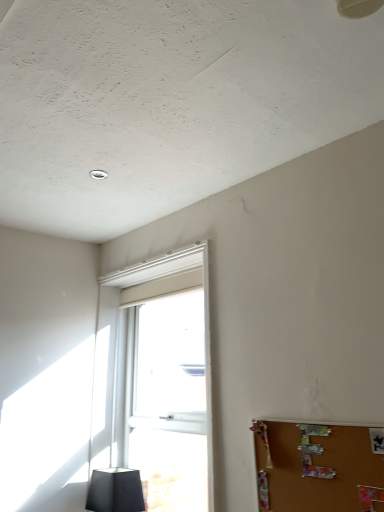
Question: Is matte black lampshade at lower left located outside brown corkboard at lower right?

Choices:
 (A) no
 (B) yes

Answer: (B)

Question: From a real-world perspective, is matte black lampshade at lower left physically below brown corkboard at lower right?

Choices:
 (A) no
 (B) yes

Answer: (B)

Question: Are matte black lampshade at lower left and brown corkboard at lower right far apart?

Choices:
 (A) yes
 (B) no

Answer: (A)

Question: Is matte black lampshade at lower left placed right next to brown corkboard at lower right?

Choices:
 (A) yes
 (B) no

Answer: (B)

Question: Does matte black lampshade at lower left have a lesser width compared to brown corkboard at lower right?

Choices:
 (A) yes
 (B) no

Answer: (B)

Question: Can you confirm if matte black lampshade at lower left is wider than brown corkboard at lower right?

Choices:
 (A) yes
 (B) no

Answer: (A)

Question: Is white plastic window at center positioned with its back to brown corkboard at lower right?

Choices:
 (A) yes
 (B) no

Answer: (B)

Question: Does white plastic window at center contain brown corkboard at lower right?

Choices:
 (A) no
 (B) yes

Answer: (A)

Question: Considering the relative sizes of white plastic window at center and brown corkboard at lower right in the image provided, is white plastic window at center smaller than brown corkboard at lower right?

Choices:
 (A) yes
 (B) no

Answer: (B)

Question: Is white plastic window at center further to the viewer compared to brown corkboard at lower right?

Choices:
 (A) no
 (B) yes

Answer: (B)

Question: Does white plastic window at center touch brown corkboard at lower right?

Choices:
 (A) yes
 (B) no

Answer: (B)

Question: From a real-world perspective, is white plastic window at center located higher than brown corkboard at lower right?

Choices:
 (A) no
 (B) yes

Answer: (B)

Question: Is brown corkboard at lower right turned away from white plastic window at center?

Choices:
 (A) no
 (B) yes

Answer: (A)